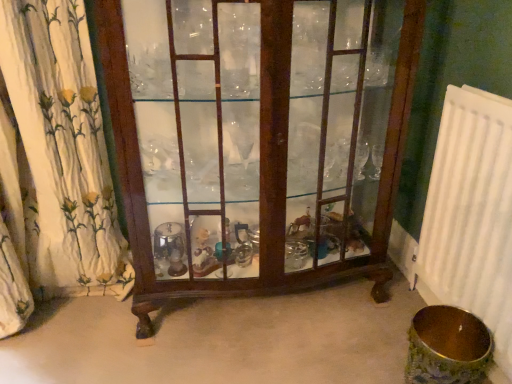
In order to click on vacant region in front of mahogany glass cabinet at center in this screenshot , I will do `click(259, 356)`.